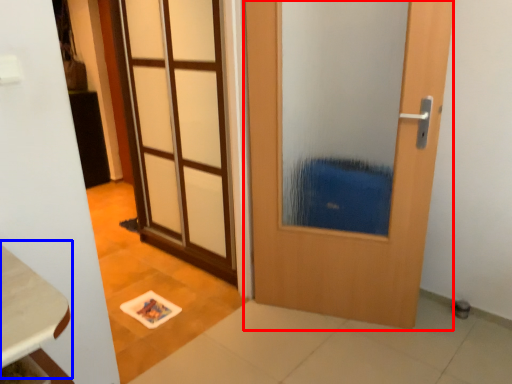
Question: Which of the following is the farthest to the observer, door (highlighted by a red box) or table (highlighted by a blue box)?

Choices:
 (A) door
 (B) table

Answer: (A)